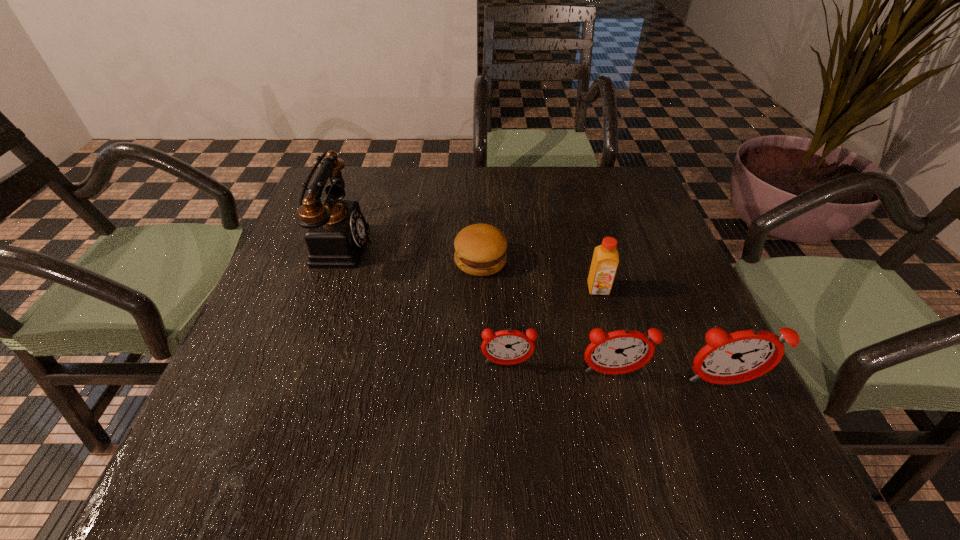
Find the location of `free spot at the right edge of the desktop`. free spot at the right edge of the desktop is located at coordinates (651, 251).

Identify the location of vacant space at the far left corner of the desktop. This screenshot has width=960, height=540. (372, 180).

Locate an element on the screen. The width and height of the screenshot is (960, 540). vacant space at the far right corner of the desktop is located at coordinates (633, 183).

The image size is (960, 540). I want to click on free space at the near right corner of the desktop, so tap(667, 392).

Find the location of `free area in between the telephone and the fifth tallest object`. free area in between the telephone and the fifth tallest object is located at coordinates (421, 303).

This screenshot has height=540, width=960. Identify the location of free point between the hamburger and the second shortest object. (493, 312).

Find the location of a particular element. The height and width of the screenshot is (540, 960). vacant area that lies between the rightmost object and the second alarm clock from right to left is located at coordinates (667, 378).

This screenshot has width=960, height=540. I want to click on free space between the second tallest alarm clock and the orange juice, so click(606, 331).

In order to click on free space between the second shortest alarm clock and the leftmost object in this screenshot , I will do pos(474,308).

The width and height of the screenshot is (960, 540). Identify the location of vacant area between the second tallest alarm clock and the tallest alarm clock. (667, 378).